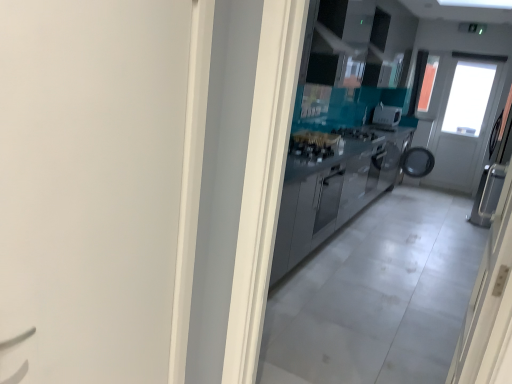
Question: Considering the positions of satin silver door at right, acting as the first door starting from the right, and satin silver cabinetry at center in the image, is satin silver door at right, acting as the first door starting from the right, taller or shorter than satin silver cabinetry at center?

Choices:
 (A) tall
 (B) short

Answer: (A)

Question: Considering their positions, is satin silver door at right, acting as the second door starting from the left, located in front of or behind satin silver cabinetry at center?

Choices:
 (A) front
 (B) behind

Answer: (A)

Question: Estimate the real-world distances between objects in this image. Which object is closer to the satin silver cabinetry at center?

Choices:
 (A) white matte door at left, which is the second door from right to left
 (B) satin silver toaster at center
 (C) satin silver door at right, acting as the second door starting from the left

Answer: (A)

Question: Which object is positioned farthest from the white matte door at left, which is the second door from right to left?

Choices:
 (A) satin silver door at right, acting as the first door starting from the right
 (B) satin silver toaster at center
 (C) satin silver cabinetry at center

Answer: (B)